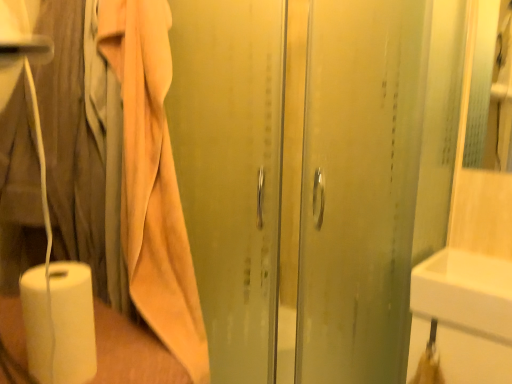
Question: Should I look upward or downward to see white glossy sink at lower right?

Choices:
 (A) down
 (B) up

Answer: (A)

Question: Are transparent glass shower door at center and beige cotton bath towel at left beside each other?

Choices:
 (A) no
 (B) yes

Answer: (A)

Question: Is transparent glass shower door at center shorter than beige cotton bath towel at left?

Choices:
 (A) no
 (B) yes

Answer: (A)

Question: From a real-world perspective, is transparent glass shower door at center on top of beige cotton bath towel at left?

Choices:
 (A) no
 (B) yes

Answer: (A)

Question: Is transparent glass shower door at center positioned before beige cotton bath towel at left?

Choices:
 (A) no
 (B) yes

Answer: (A)

Question: Is transparent glass shower door at center further to camera compared to beige cotton bath towel at left?

Choices:
 (A) yes
 (B) no

Answer: (A)

Question: From the image's perspective, is transparent glass shower door at center below beige cotton bath towel at left?

Choices:
 (A) no
 (B) yes

Answer: (B)

Question: Is white glossy sink at lower right closer to the viewer compared to beige cotton bath towel at left?

Choices:
 (A) yes
 (B) no

Answer: (B)

Question: Does white glossy sink at lower right have a greater width compared to beige cotton bath towel at left?

Choices:
 (A) yes
 (B) no

Answer: (B)

Question: From the image's perspective, would you say white glossy sink at lower right is positioned over beige cotton bath towel at left?

Choices:
 (A) no
 (B) yes

Answer: (A)

Question: From a real-world perspective, is white glossy sink at lower right positioned under beige cotton bath towel at left based on gravity?

Choices:
 (A) yes
 (B) no

Answer: (A)

Question: Is white glossy sink at lower right not within beige cotton bath towel at left?

Choices:
 (A) yes
 (B) no

Answer: (A)

Question: Is white glossy sink at lower right facing away from beige cotton bath towel at left?

Choices:
 (A) no
 (B) yes

Answer: (A)

Question: Considering the relative positions of white matte paper towel at lower left and white glossy sink at lower right in the image provided, is white matte paper towel at lower left to the left of white glossy sink at lower right from the viewer's perspective?

Choices:
 (A) no
 (B) yes

Answer: (B)